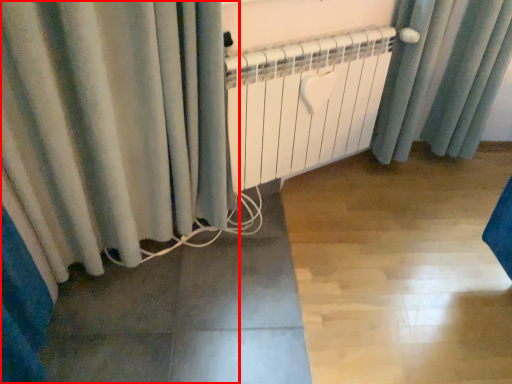
Question: From the image's perspective, where is curtain (annotated by the red box) located in relation to radiator in the image?

Choices:
 (A) above
 (B) below

Answer: (B)